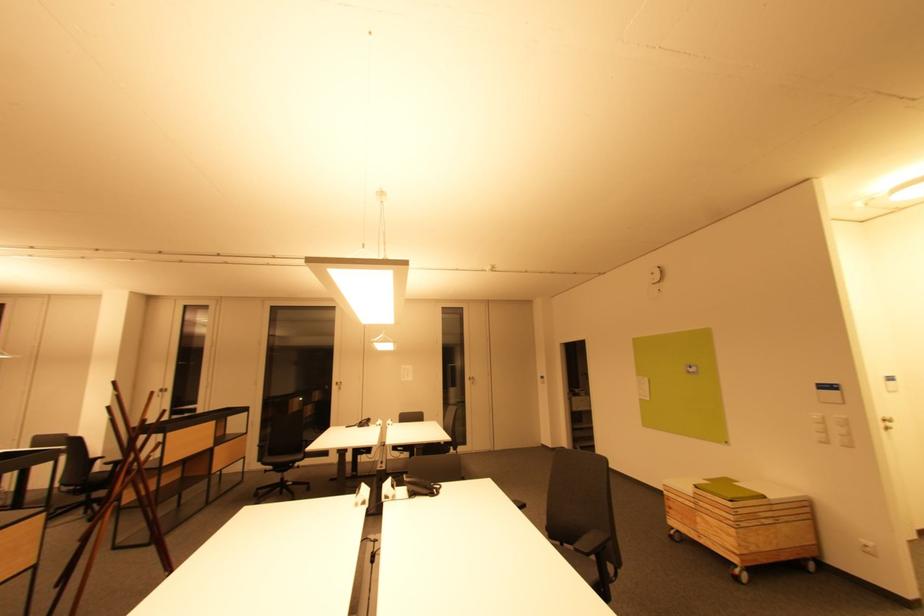
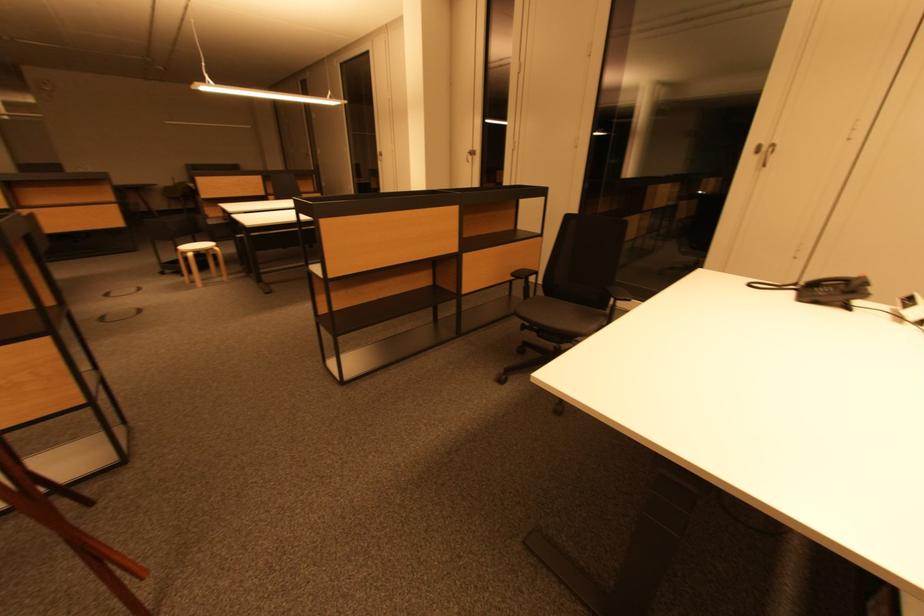
Locate, in the second image, the point that corresponds to point 222,451 in the first image.

(470, 259)